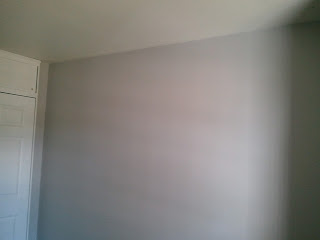
The width and height of the screenshot is (320, 240). Identify the location of small panel in door. (14, 118).